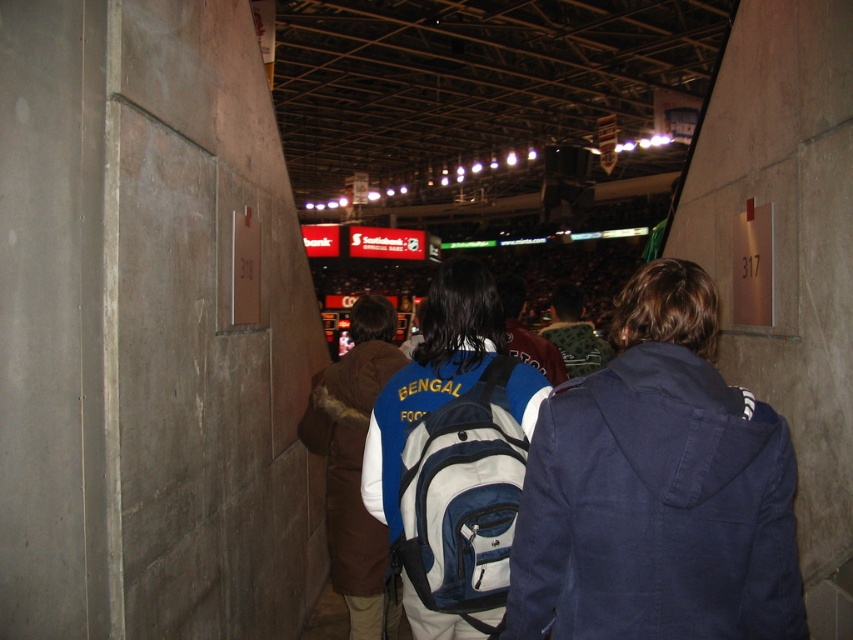
Question: Among these points, which one is farthest from the camera?

Choices:
 (A) (397, 476)
 (B) (372, 284)
 (C) (630, 323)

Answer: (B)

Question: Can you confirm if blue fabric backpack at center is positioned to the left of green knitted hat at center?

Choices:
 (A) no
 (B) yes

Answer: (B)

Question: Which point is farther to the camera?

Choices:
 (A) (509, 266)
 (B) (125, 118)

Answer: (A)

Question: Where is brown fuzzy vest at center located in relation to green knitted hat at center in the image?

Choices:
 (A) right
 (B) left

Answer: (B)

Question: Can you confirm if concrete wall at center is bigger than brown fuzzy vest at center?

Choices:
 (A) yes
 (B) no

Answer: (B)

Question: Which of the following is the closest to the observer?

Choices:
 (A) dark blue jacket at center
 (B) green knitted hat at center

Answer: (B)